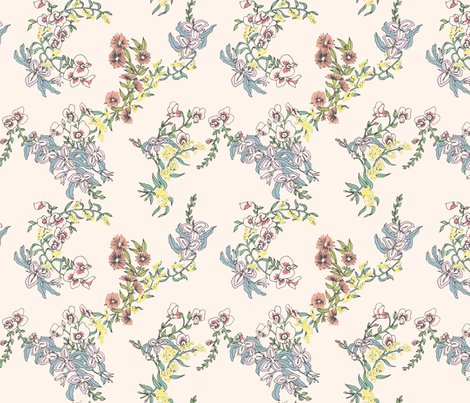
Locate an element on the screen. flower at the left center is located at coordinates (52, 223).